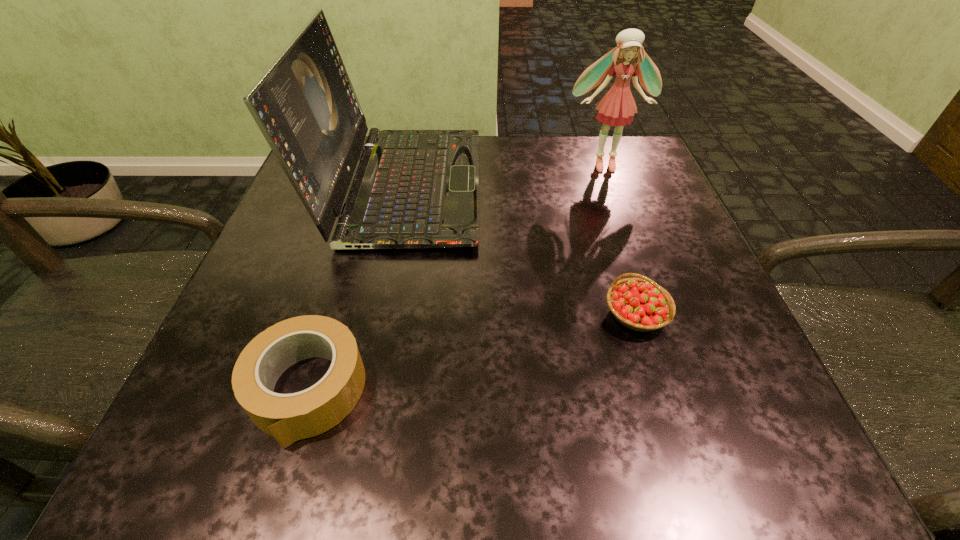
Image resolution: width=960 pixels, height=540 pixels. What are the coordinates of `laptop computer that is at the left edge` in the screenshot? It's located at (413, 188).

Where is `duct tape that is at the left edge`? duct tape that is at the left edge is located at coordinates (288, 418).

Find the location of `doll that is at the right edge`. doll that is at the right edge is located at coordinates (616, 108).

The height and width of the screenshot is (540, 960). I want to click on strawberry present at the right edge, so click(640, 304).

Locate an element on the screen. object located at the far left corner is located at coordinates (413, 188).

Locate an element on the screen. This screenshot has height=540, width=960. object located in the near left corner section of the desktop is located at coordinates (288, 418).

Where is `object that is positioned at the far right corner`? The width and height of the screenshot is (960, 540). object that is positioned at the far right corner is located at coordinates (616, 108).

You are a GUI agent. You are given a task and a screenshot of the screen. Output one action in this format:
    pyautogui.click(x=<x>, y=<y>)
    Task: Click on the free region at the near edge of the desktop
    This screenshot has height=540, width=960.
    Given the screenshot: What is the action you would take?
    pyautogui.click(x=359, y=450)

This screenshot has height=540, width=960. I want to click on blank space at the left edge, so click(297, 259).

This screenshot has width=960, height=540. I want to click on vacant space at the right edge of the desktop, so click(x=674, y=285).